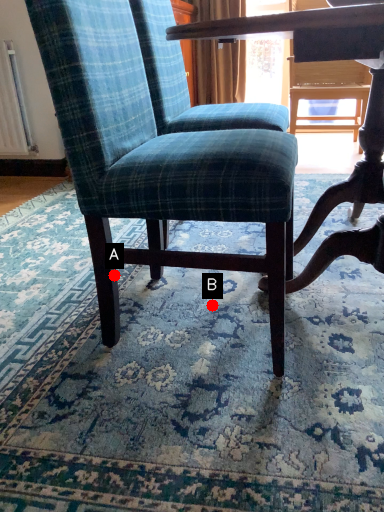
Question: Two points are circled on the image, labeled by A and B beside each circle. Among these points, which one is farthest from the camera?

Choices:
 (A) A is further
 (B) B is further

Answer: (B)